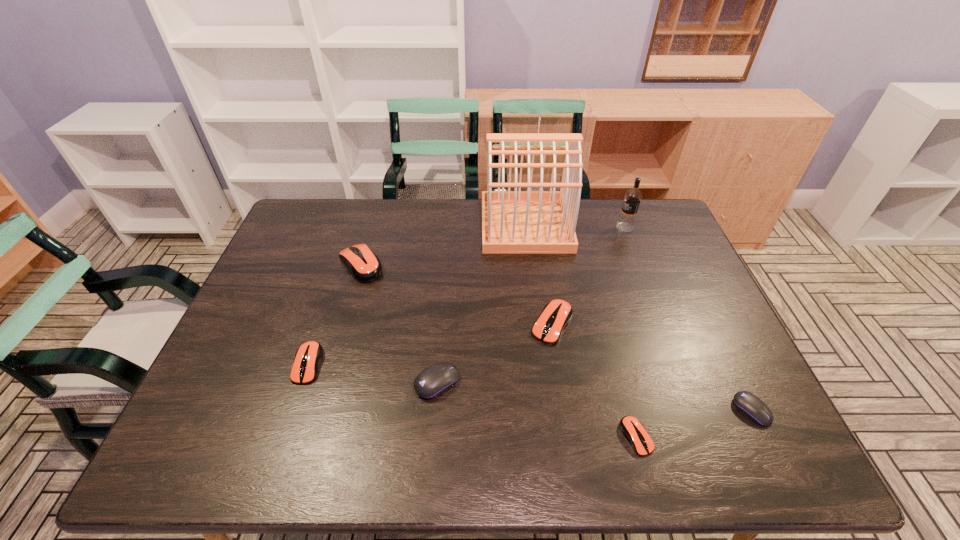
You are a GUI agent. You are given a task and a screenshot of the screen. Output one action in this format:
    pyautogui.click(x=<x>, y=<y>)
    Task: Click on the vacant point located between the rightmost orange computer mouse and the third orange computer mouse from left to right
    Image resolution: width=960 pixels, height=540 pixels.
    Given the screenshot: What is the action you would take?
    pyautogui.click(x=594, y=381)

This screenshot has height=540, width=960. Identify the location of blank region between the second smallest orange computer mouse and the fourth computer mouse from right to left. (373, 373).

Identify the location of free space between the third smallest orange computer mouse and the sixth object from left to right. click(x=594, y=381).

This screenshot has height=540, width=960. What are the coordinates of `unoccupied position between the shortest computer mouse and the second smallest orange computer mouse` in the screenshot? It's located at (472, 401).

Find the location of a particular element. This screenshot has width=960, height=540. free spot between the sixth object from right to left and the biggest orange computer mouse is located at coordinates (399, 323).

Find the location of a particular element. The image size is (960, 540). free space between the second biggest orange computer mouse and the nearest orange computer mouse is located at coordinates (x=594, y=381).

Locate an element on the screen. free spot between the second smallest orange computer mouse and the second orange computer mouse from right to left is located at coordinates (430, 344).

Where is `empty space between the left black computer mouse and the second smallest orange computer mouse`? This screenshot has width=960, height=540. empty space between the left black computer mouse and the second smallest orange computer mouse is located at coordinates point(373,373).

Locate an element on the screen. This screenshot has height=540, width=960. vacant point located between the rightmost object and the seventh object from left to right is located at coordinates (688, 319).

Where is `vacant area that lies between the second smallest orange computer mouse and the shortest object`? The height and width of the screenshot is (540, 960). vacant area that lies between the second smallest orange computer mouse and the shortest object is located at coordinates (472, 401).